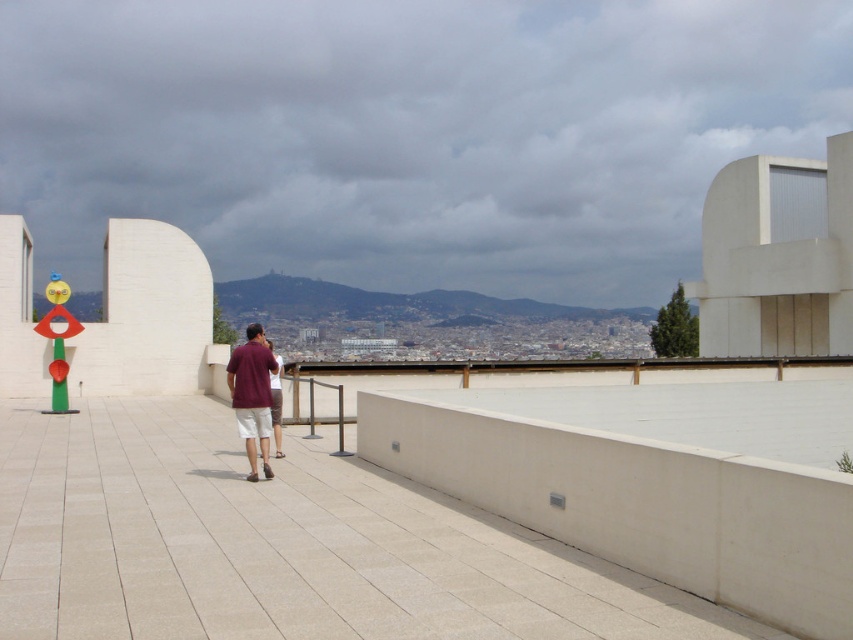
You are standing on the rooftop and want to place a small potted plant on the white tile pavement at center. The potted plant is the same size as the maroon fabric shirt at center. Will the plant fit on the pavement?

The white tile pavement at center has a smaller size compared to the maroon fabric shirt at center. Since the potted plant is the same size as the maroon fabric shirt at center, it will not fit on the pavement.